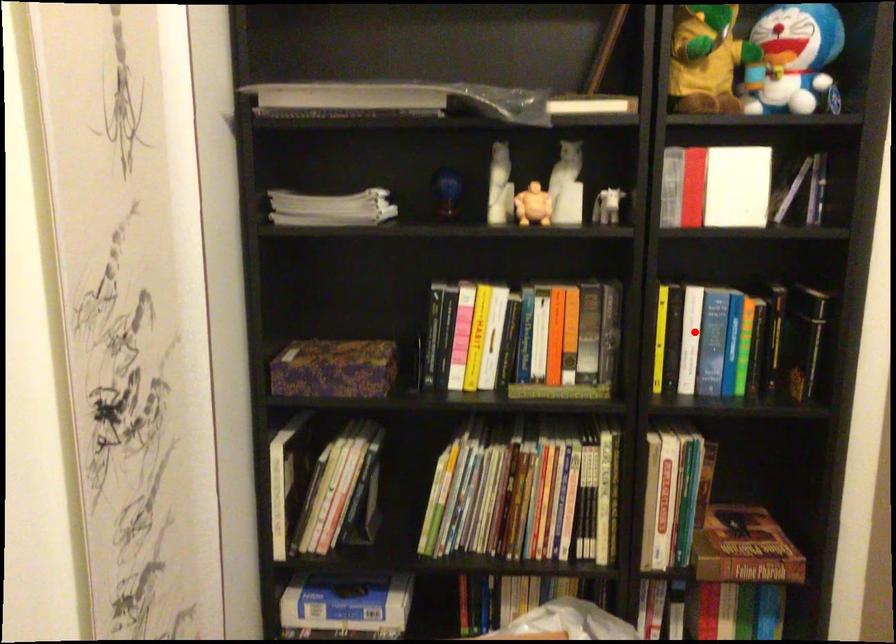
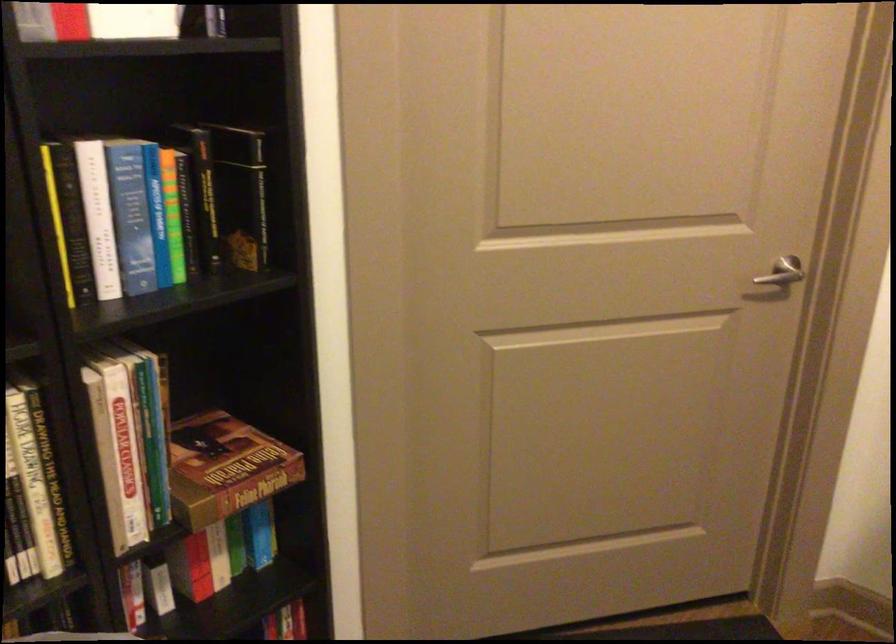
In the second image, find the point that corresponds to the highlighted location in the first image.

(98, 216)